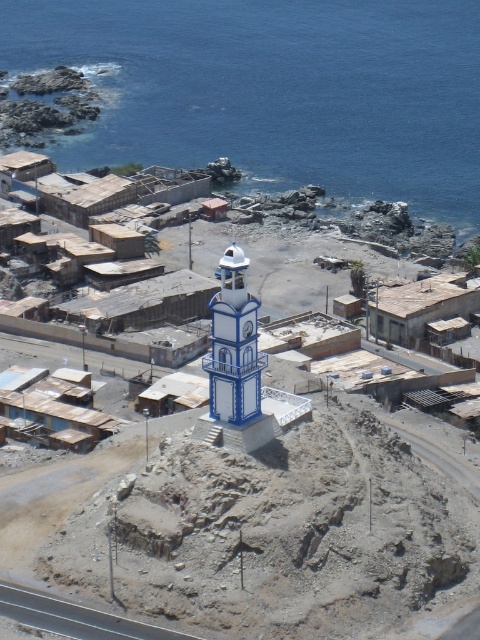
Question: Which point is closer to the camera?

Choices:
 (A) white painted brick bell tower at center
 (B) wooden shacks at center
 (C) blue water at upper center

Answer: (A)

Question: Is blue water at upper center smaller than white painted brick bell tower at center?

Choices:
 (A) no
 (B) yes

Answer: (A)

Question: Does wooden shacks at center appear on the left side of white painted brick bell tower at center?

Choices:
 (A) yes
 (B) no

Answer: (A)

Question: Which point appears closest to the camera in this image?

Choices:
 (A) 416,92
 (B) 104,292

Answer: (B)

Question: Which object is closer to the camera taking this photo?

Choices:
 (A) white painted brick bell tower at center
 (B) blue water at upper center

Answer: (A)

Question: Is blue water at upper center to the right of wooden shacks at center from the viewer's perspective?

Choices:
 (A) yes
 (B) no

Answer: (A)